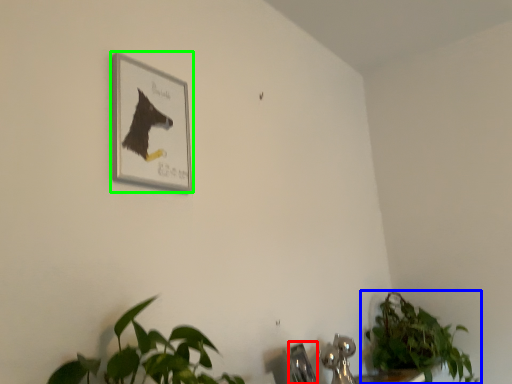
Question: Which is nearer to the faucet (highlighted by a red box)? houseplant (highlighted by a blue box) or picture frame (highlighted by a green box).

Choices:
 (A) houseplant
 (B) picture frame

Answer: (A)